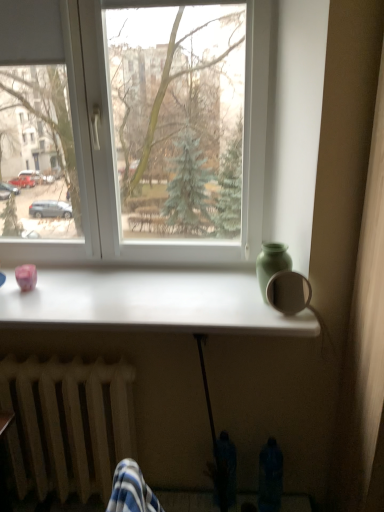
At what (x,y) coordinates should I click in order to perform the action: click on wooden radiator at lower left. Please return your answer as a coordinate pair (x, y). This screenshot has width=384, height=512. Looking at the image, I should click on (67, 424).

Identify the location of white glossy table at center. (149, 302).

The width and height of the screenshot is (384, 512). What do you see at coordinates (271, 263) in the screenshot?
I see `green matte vase at upper right` at bounding box center [271, 263].

What are the coordinates of `wooden radiator at lower left` in the screenshot? It's located at (67, 424).

Are green matte vase at upper right and white plastic window at center making contact?

No, green matte vase at upper right is not beside white plastic window at center.

Is white plastic window at center at the back of green matte vase at upper right?

That's right, green matte vase at upper right is facing away from white plastic window at center.

Is green matte vase at upper right in front of or behind white plastic window at center in the image?

In the image, green matte vase at upper right appears in front of white plastic window at center.

Identify the location of glass vase below the white plastic window at center (from the image's perspective). The width and height of the screenshot is (384, 512). (271, 263).

Which is behind, point (80, 281) or point (77, 394)?

Point (80, 281)

From a real-world perspective, is white glossy table at center positioned above or below wooden radiator at lower left?

Clearly, from a real-world perspective, white glossy table at center is above wooden radiator at lower left.

Does white glossy table at center appear on the left side of wooden radiator at lower left?

In fact, white glossy table at center is to the right of wooden radiator at lower left.

What are the coordinates of `radiator located on the left of white glossy table at center` in the screenshot? It's located at (67, 424).

Considering the relative sizes of white plastic window at center and white glossy table at center in the image provided, is white plastic window at center taller than white glossy table at center?

Indeed, white plastic window at center has a greater height compared to white glossy table at center.

Considering the positions of objects white plastic window at center and white glossy table at center in the image provided, who is more to the left, white plastic window at center or white glossy table at center?

white plastic window at center.

Looking at their sizes, would you say white plastic window at center is wider or thinner than white glossy table at center?

Clearly, white plastic window at center has less width compared to white glossy table at center.

From a real-world perspective, who is located lower, white plastic window at center or white glossy table at center?

white glossy table at center is physically lower.

In the image, is white plastic window at center positioned in front of or behind wooden radiator at lower left?

white plastic window at center is positioned farther from the viewer than wooden radiator at lower left.

From a real-world perspective, is white plastic window at center located beneath wooden radiator at lower left?

Actually, white plastic window at center is physically above wooden radiator at lower left in the real world.

Is white plastic window at center surrounding wooden radiator at lower left?

No, white plastic window at center does not contain wooden radiator at lower left.

Is white plastic window at center wider than wooden radiator at lower left?

No, white plastic window at center is not wider than wooden radiator at lower left.

In terms of size, does white glossy table at center appear bigger or smaller than white plastic window at center?

In the image, white glossy table at center appears to be smaller than white plastic window at center.

Between white glossy table at center and white plastic window at center, which one has more height?

white plastic window at center.

Are white glossy table at center and white plastic window at center beside each other?

No, white glossy table at center is not in contact with white plastic window at center.

From the picture: Which object is closer to the camera, white glossy table at center or white plastic window at center?

white glossy table at center is closer to the camera.

Are wooden radiator at lower left and green matte vase at upper right far apart?

wooden radiator at lower left is actually quite close to green matte vase at upper right.

Which is less distant, (84, 421) or (267, 281)?

Positioned in front is point (84, 421).

Is wooden radiator at lower left further to camera compared to green matte vase at upper right?

Yes, wooden radiator at lower left is further from the viewer.

From the image's perspective, which one is positioned lower, white glossy table at center or green matte vase at upper right?

white glossy table at center.

Where is `glass vase behind the white glossy table at center`? Image resolution: width=384 pixels, height=512 pixels. glass vase behind the white glossy table at center is located at coordinates (271, 263).

From the picture: From a real-world perspective, between white glossy table at center and green matte vase at upper right, who is vertically lower?

white glossy table at center is physically lower.

Identify the location of window behind the green matte vase at upper right. This screenshot has width=384, height=512. (112, 136).

You are a GUI agent. You are given a task and a screenshot of the screen. Output one action in this format:
    pyautogui.click(x=<x>, y=<y>)
    Task: Click on the radiator beneath the white glossy table at center (from a real-world perspective)
    
    Given the screenshot: What is the action you would take?
    pyautogui.click(x=67, y=424)

Which object lies nearer to the anchor point green matte vase at upper right, wooden radiator at lower left or white plastic window at center?

white plastic window at center is closer to green matte vase at upper right.

Which object lies nearer to the anchor point wooden radiator at lower left, green matte vase at upper right or white glossy table at center?

Based on the image, white glossy table at center appears to be nearer to wooden radiator at lower left.

Considering their positions, is green matte vase at upper right positioned closer to wooden radiator at lower left than white plastic window at center?

Among the two, white plastic window at center is located nearer to wooden radiator at lower left.

Based on the photo, from the image, which object appears to be nearer to white plastic window at center, green matte vase at upper right or wooden radiator at lower left?

Based on the image, green matte vase at upper right appears to be nearer to white plastic window at center.

Which object lies nearer to the anchor point white glossy table at center, white plastic window at center or wooden radiator at lower left?

white plastic window at center lies closer to white glossy table at center than the other object.

From the image, which object appears to be farther from green matte vase at upper right, white glossy table at center or wooden radiator at lower left?

Based on the image, wooden radiator at lower left appears to be further to green matte vase at upper right.

Considering their positions, is white plastic window at center positioned further to white glossy table at center than green matte vase at upper right?

green matte vase at upper right.

Considering their positions, is green matte vase at upper right positioned closer to white glossy table at center than wooden radiator at lower left?

green matte vase at upper right lies closer to white glossy table at center than the other object.

In order to click on glass vase between white plastic window at center and wooden radiator at lower left in the vertical direction in this screenshot , I will do `click(271, 263)`.

Identify the location of table between wooden radiator at lower left and green matte vase at upper right. (149, 302).

The width and height of the screenshot is (384, 512). I want to click on glass vase between white plastic window at center and white glossy table at center from top to bottom, so click(271, 263).

Where is `table between white plastic window at center and wooden radiator at lower left in the up-down direction`? The height and width of the screenshot is (512, 384). table between white plastic window at center and wooden radiator at lower left in the up-down direction is located at coordinates (149, 302).